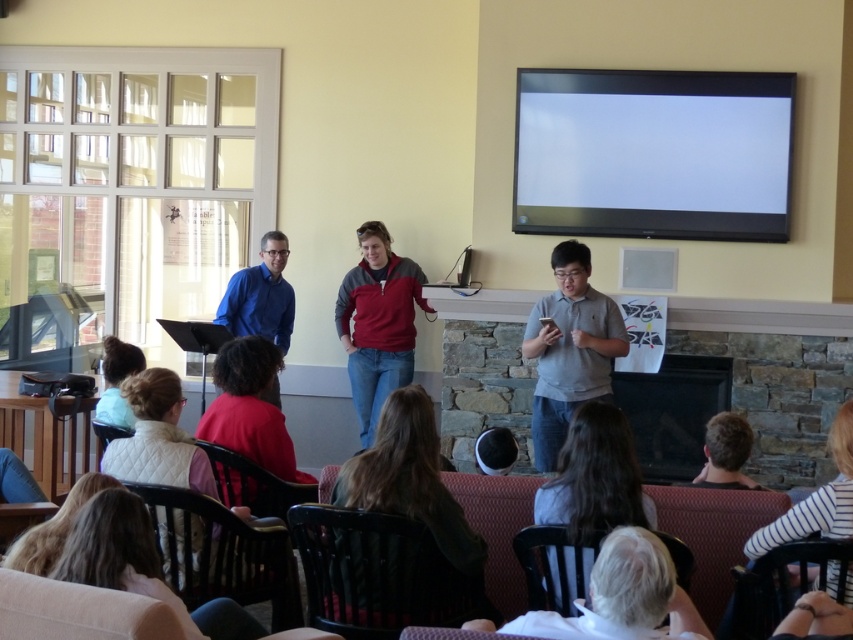
You are standing at the camera position and want to walk to the dark brown leather chair at center. How many steps would you need to take if each step is approximately 3 feet long?

The distance between you and the dark brown leather chair at center is 10.46 feet. Since each step covers about 3 feet, you would need to take approximately 4 steps to reach it.

You are a photographer standing behind the group of people. You want to capture a photo that includes both the red cotton shirt at center and the blonde hair at lower left without any part of them being cut off. What is the minimum distance you should keep between the camera and the front row to ensure both subjects are fully visible?

The minimum distance should be at least 28.62 inches to ensure both the red cotton shirt at center and the blonde hair at lower left are fully visible in the photo.